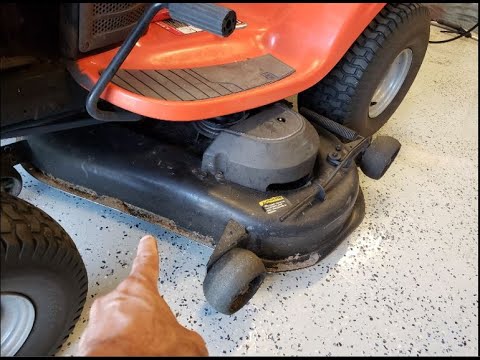
At what (x,y) coordinates should I click in order to perform the action: click on vent. Please return your answer as a coordinate pair (x, y). Looking at the image, I should click on (111, 20).